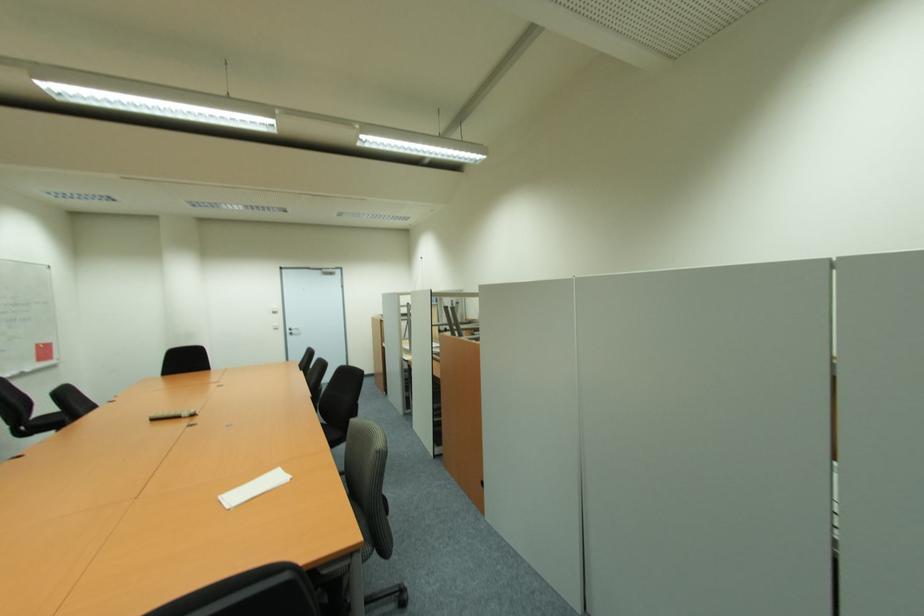
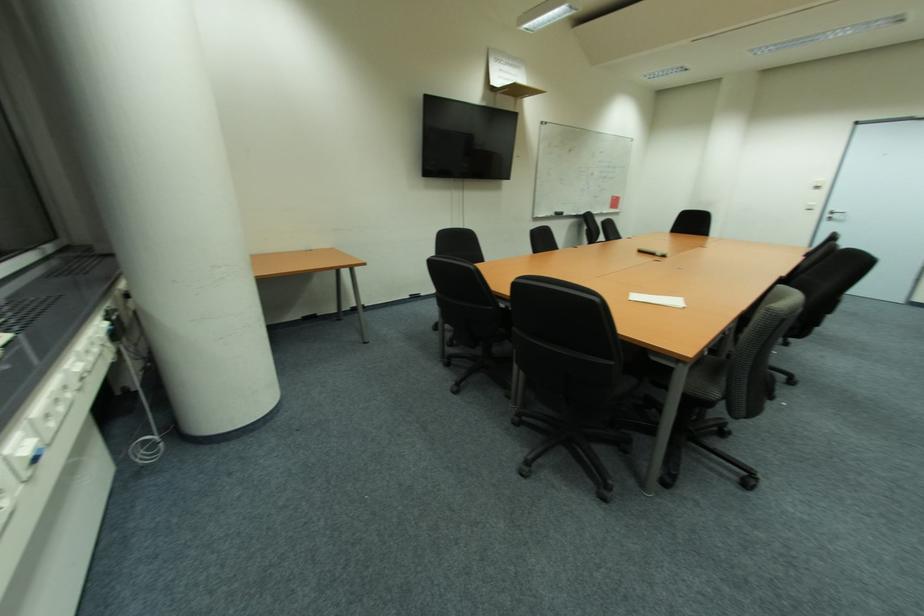
In the second image, find the point that corresponds to point (297, 331) in the first image.

(842, 217)